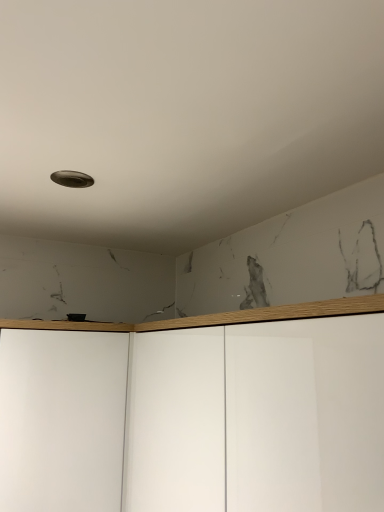
Question: From the image's perspective, is white matte cabinet at center positioned above or below white glossy cabinet at lower left?

Choices:
 (A) below
 (B) above

Answer: (B)

Question: Is white matte cabinet at center situated inside white glossy cabinet at lower left or outside?

Choices:
 (A) inside
 (B) outside

Answer: (B)

Question: Relative to white glossy cabinet at lower left, is white matte cabinet at center in front or behind?

Choices:
 (A) behind
 (B) front

Answer: (B)

Question: Is white glossy cabinet at lower left spatially inside white matte cabinet at center, or outside of it?

Choices:
 (A) outside
 (B) inside

Answer: (A)

Question: In terms of height, does white glossy cabinet at lower left look taller or shorter compared to white matte cabinet at center?

Choices:
 (A) tall
 (B) short

Answer: (A)

Question: Is white glossy cabinet at lower left to the left or to the right of white matte cabinet at center in the image?

Choices:
 (A) left
 (B) right

Answer: (A)

Question: From the image's perspective, relative to white matte cabinet at center, is white glossy cabinet at lower left above or below?

Choices:
 (A) above
 (B) below

Answer: (B)